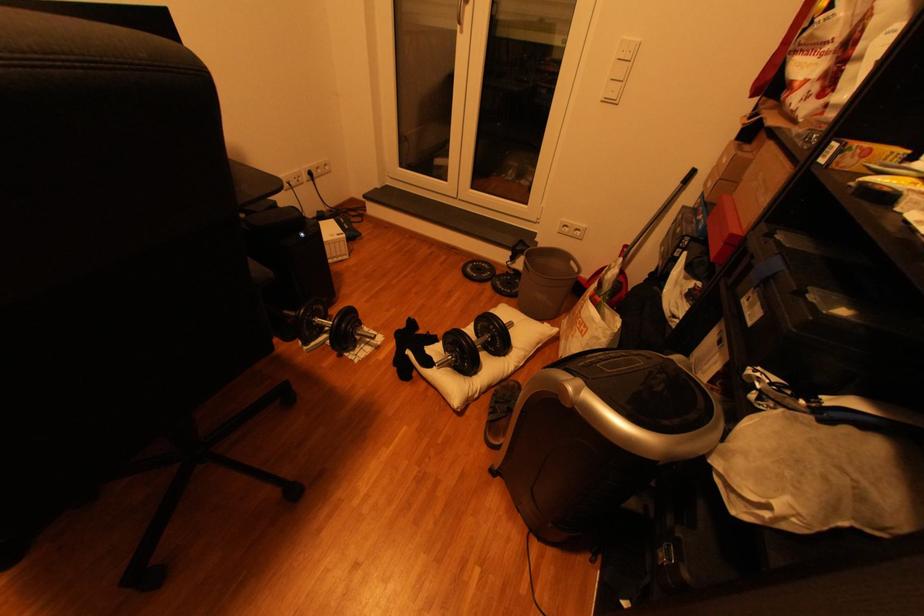
The image size is (924, 616). Find the location of `white door handle`. white door handle is located at coordinates (460, 13).